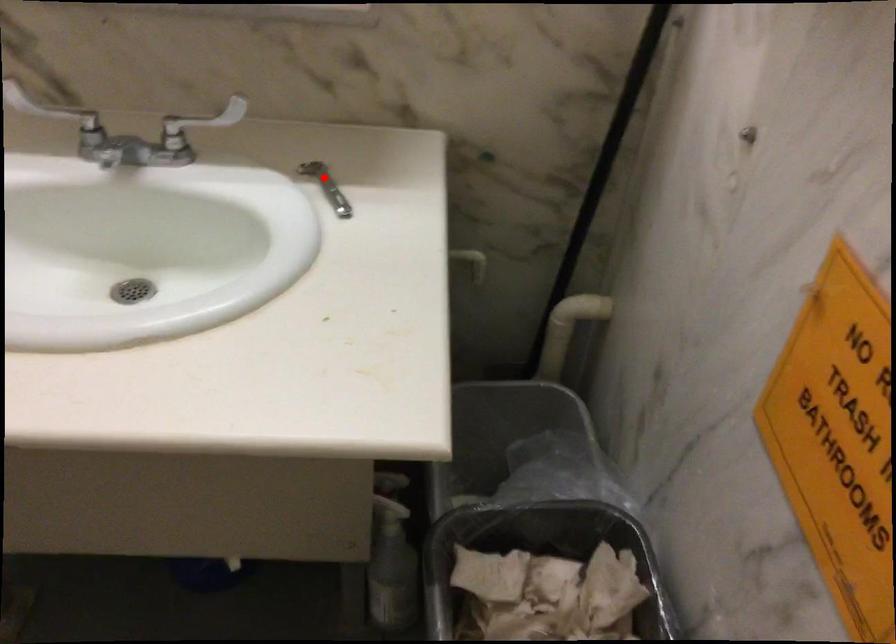
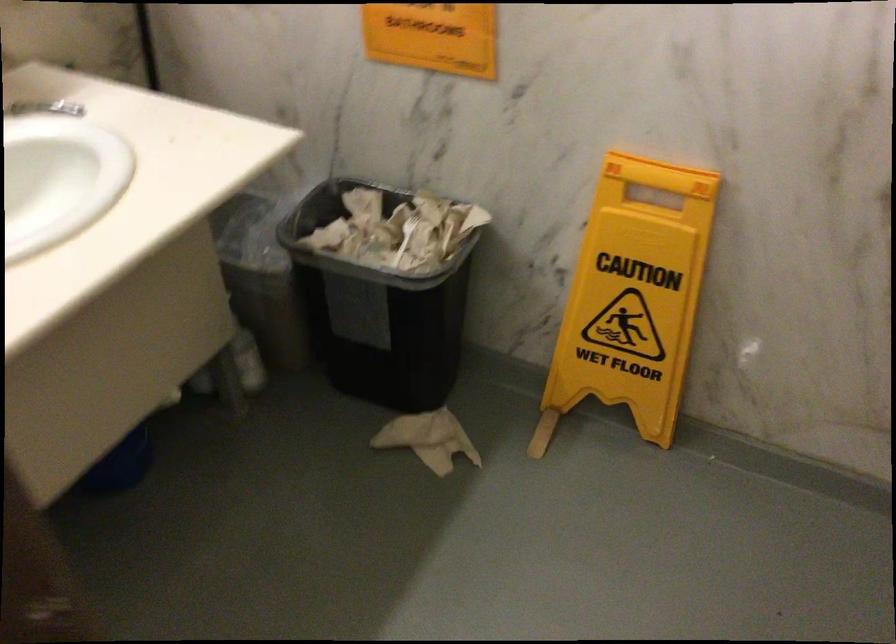
Question: I am providing you with two images of the same scene from different viewpoints. In image1, a red point is highlighted. Considering the same 3D point in image2, which of the following is correct?

Choices:
 (A) It is closer
 (B) It is farther

Answer: (B)